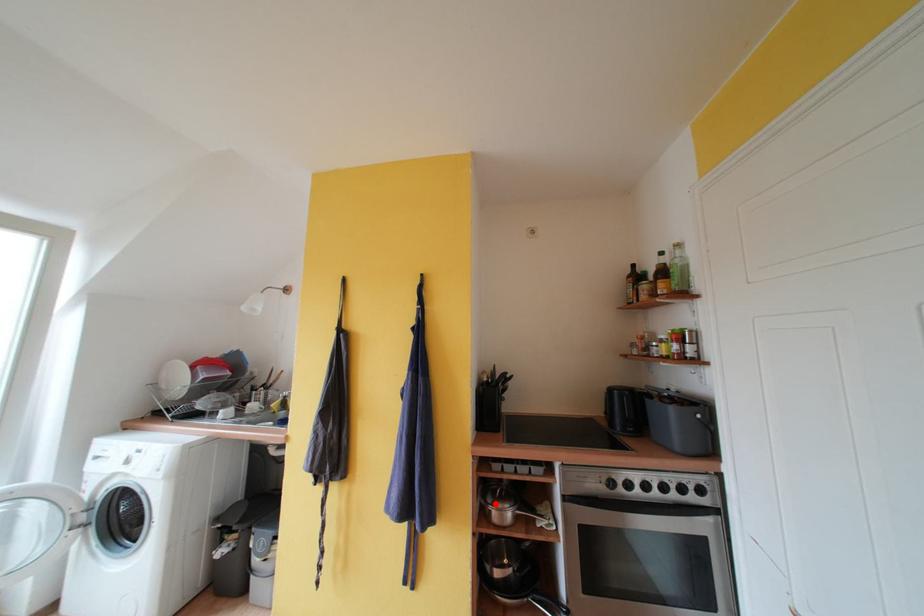
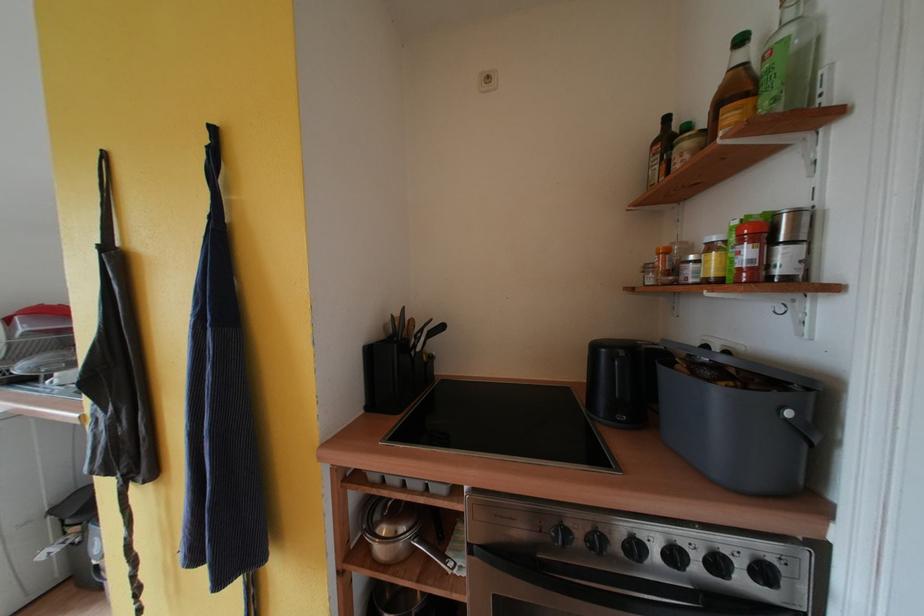
In the second image, find the point that corresponds to the highlighted location in the first image.

(383, 521)